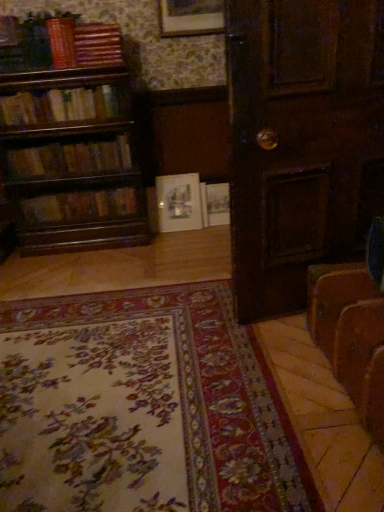
Question: Is wooden book at upper left, which is counted as the sixth book, starting from the bottom, shorter than wooden book at upper left, acting as the 2th book starting from the top?

Choices:
 (A) no
 (B) yes

Answer: (B)

Question: Does wooden book at upper left, which is counted as the sixth book, starting from the bottom, appear on the left side of wooden book at upper left, positioned as the fifth book in bottom-to-top order?

Choices:
 (A) no
 (B) yes

Answer: (A)

Question: Is wooden book at upper left, arranged as the first book when viewed from the top, oriented away from wooden book at upper left, positioned as the fifth book in bottom-to-top order?

Choices:
 (A) no
 (B) yes

Answer: (A)

Question: Considering the relative sizes of wooden book at upper left, which is counted as the sixth book, starting from the bottom, and wooden book at upper left, positioned as the fifth book in bottom-to-top order, in the image provided, is wooden book at upper left, which is counted as the sixth book, starting from the bottom, thinner than wooden book at upper left, positioned as the fifth book in bottom-to-top order,?

Choices:
 (A) no
 (B) yes

Answer: (B)

Question: From a real-world perspective, is wooden book at upper left, arranged as the first book when viewed from the top, under wooden book at upper left, acting as the 2th book starting from the top?

Choices:
 (A) no
 (B) yes

Answer: (B)

Question: Does point (314, 276) appear closer or farther from the camera than point (56, 53)?

Choices:
 (A) closer
 (B) farther

Answer: (A)

Question: Is brown leather suitcase at lower right in front of or behind wooden book at upper left, acting as the 2th book starting from the top, in the image?

Choices:
 (A) front
 (B) behind

Answer: (A)

Question: In the image, is brown leather suitcase at lower right on the left side or the right side of wooden book at upper left, acting as the 2th book starting from the top?

Choices:
 (A) left
 (B) right

Answer: (B)

Question: From the image's perspective, is brown leather suitcase at lower right located above or below wooden book at upper left, acting as the 2th book starting from the top?

Choices:
 (A) below
 (B) above

Answer: (A)

Question: Based on their sizes in the image, would you say floral carpet at lower center is bigger or smaller than wooden bookshelf at left, the fourth book ordered from the bottom?

Choices:
 (A) small
 (B) big

Answer: (B)

Question: Is floral carpet at lower center taller or shorter than wooden bookshelf at left, acting as the 3th book starting from the top?

Choices:
 (A) tall
 (B) short

Answer: (B)

Question: Based on their positions, is floral carpet at lower center located to the left or right of wooden bookshelf at left, the fourth book ordered from the bottom?

Choices:
 (A) right
 (B) left

Answer: (A)

Question: From the image's perspective, relative to wooden bookshelf at left, acting as the 3th book starting from the top, is floral carpet at lower center above or below?

Choices:
 (A) below
 (B) above

Answer: (A)

Question: From a real-world perspective, is wooden bookshelf at left, acting as the 3th book starting from the top, positioned above or below wooden picture frame at upper center, arranged as the second picture frame when ordered from the bottom?

Choices:
 (A) above
 (B) below

Answer: (B)

Question: Is wooden bookshelf at left, acting as the 3th book starting from the top, situated inside wooden picture frame at upper center, the first picture frame from the top, or outside?

Choices:
 (A) inside
 (B) outside

Answer: (B)